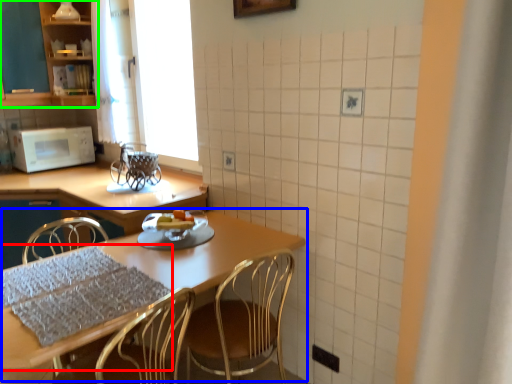
Question: Which object is the closest to the tablecloth (highlighted by a red box)? Choose among these: table (highlighted by a blue box) or cabinetry (highlighted by a green box).

Choices:
 (A) table
 (B) cabinetry

Answer: (A)